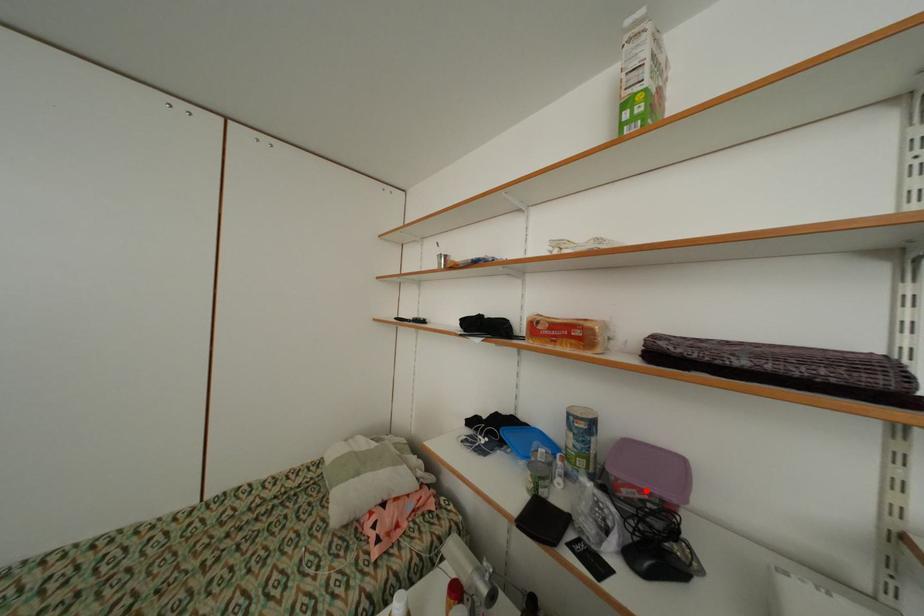
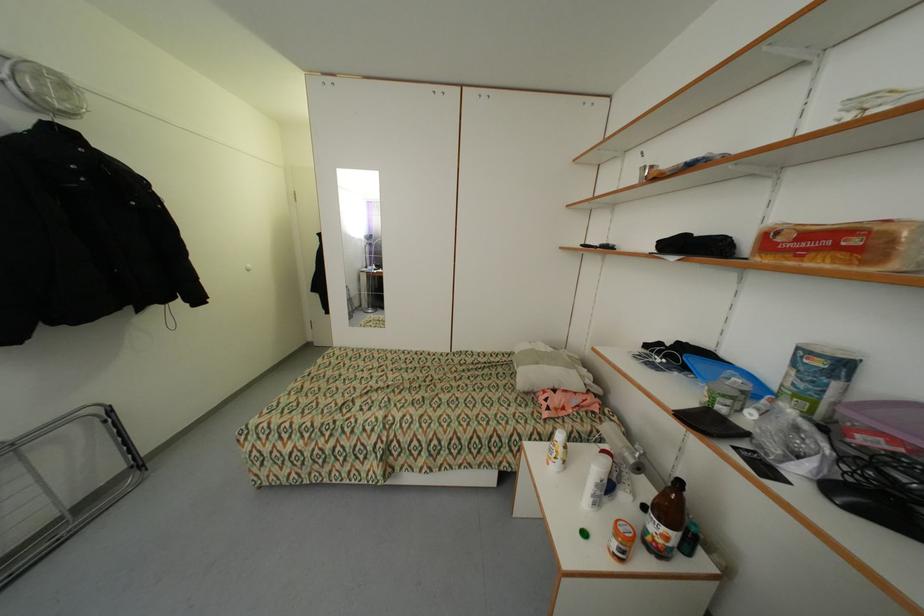
In the second image, find the point that corresponds to the highlighted location in the first image.

(900, 440)